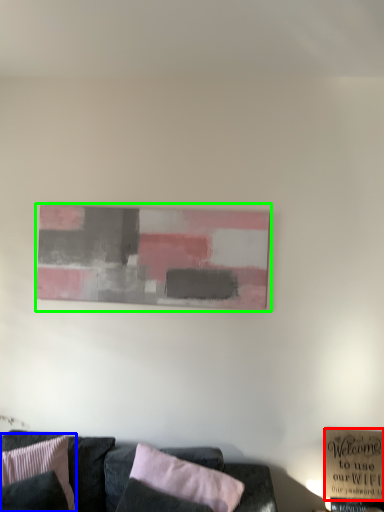
Question: Which is farther away from plaque (highlighted by a red box)? pillow (highlighted by a blue box) or picture frame (highlighted by a green box)?

Choices:
 (A) pillow
 (B) picture frame

Answer: (A)